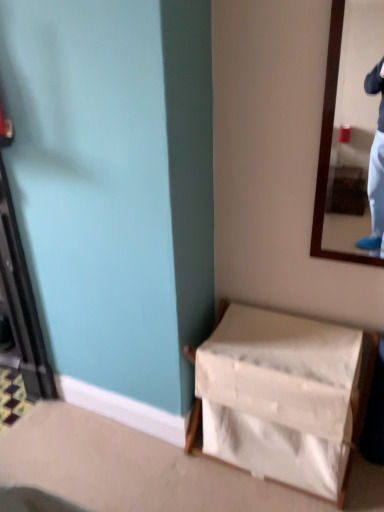
This screenshot has height=512, width=384. What do you see at coordinates (330, 143) in the screenshot? I see `wooden-framed mirror at upper right` at bounding box center [330, 143].

Where is `wooden-framed mirror at upper right`? wooden-framed mirror at upper right is located at coordinates (330, 143).

What is the approximate width of white fabric basket at lower right?

white fabric basket at lower right is 16.04 inches wide.

Identify the location of white fabric basket at lower right. The image size is (384, 512). (278, 396).

Image resolution: width=384 pixels, height=512 pixels. What do you see at coordinates (278, 396) in the screenshot? I see `white fabric basket at lower right` at bounding box center [278, 396].

Where is `wooden-framed mirror at upper right`? This screenshot has height=512, width=384. wooden-framed mirror at upper right is located at coordinates (330, 143).

In the image, is white fabric basket at lower right on the left side or the right side of wooden-framed mirror at upper right?

white fabric basket at lower right is positioned on wooden-framed mirror at upper right's left side.

Does white fabric basket at lower right lie in front of wooden-framed mirror at upper right?

No.

Does point (207, 420) lie in front of point (326, 106)?

No, it is not.

From the image's perspective, is white fabric basket at lower right above wooden-framed mirror at upper right?

Actually, white fabric basket at lower right appears below wooden-framed mirror at upper right in the image.

From a real-world perspective, which is physically below, white fabric basket at lower right or wooden-framed mirror at upper right?

In real-world perspective, white fabric basket at lower right is lower.

Considering the sizes of white fabric basket at lower right and wooden-framed mirror at upper right in the image, is white fabric basket at lower right wider or thinner than wooden-framed mirror at upper right?

white fabric basket at lower right is wider than wooden-framed mirror at upper right.

Consider the image. Does white fabric basket at lower right have a lesser height compared to wooden-framed mirror at upper right?

Yes, white fabric basket at lower right is shorter than wooden-framed mirror at upper right.

Considering the sizes of objects white fabric basket at lower right and wooden-framed mirror at upper right in the image provided, who is smaller, white fabric basket at lower right or wooden-framed mirror at upper right?

wooden-framed mirror at upper right is smaller.

Does white fabric basket at lower right contain wooden-framed mirror at upper right?

That's incorrect, wooden-framed mirror at upper right is not inside white fabric basket at lower right.

Is white fabric basket at lower right touching wooden-framed mirror at upper right?

No, white fabric basket at lower right is not next to wooden-framed mirror at upper right.

Is white fabric basket at lower right aimed at wooden-framed mirror at upper right?

No, white fabric basket at lower right does not turn towards wooden-framed mirror at upper right.

Can you tell me how much white fabric basket at lower right and wooden-framed mirror at upper right differ in facing direction?

They differ by 0.00792 degrees in their facing directions.

At what (x,y) coordinates should I click in order to perform the action: click on mirror on the right of white fabric basket at lower right. Please return your answer as a coordinate pair (x, y). The image size is (384, 512). Looking at the image, I should click on (330, 143).

Consider the image. Is wooden-framed mirror at upper right to the left of white fabric basket at lower right from the viewer's perspective?

Incorrect, wooden-framed mirror at upper right is not on the left side of white fabric basket at lower right.

Considering the relative positions of wooden-framed mirror at upper right and white fabric basket at lower right in the image provided, is wooden-framed mirror at upper right in front of white fabric basket at lower right?

Yes, wooden-framed mirror at upper right is closer to the viewer.

Is point (331, 44) closer or farther from the camera than point (209, 380)?

Point (331, 44) is closer to the camera than point (209, 380).

From the image's perspective, which is below, wooden-framed mirror at upper right or white fabric basket at lower right?

white fabric basket at lower right.

From a real-world perspective, relative to white fabric basket at lower right, is wooden-framed mirror at upper right vertically above or below?

Clearly, from a real-world perspective, wooden-framed mirror at upper right is above white fabric basket at lower right.

Can you confirm if wooden-framed mirror at upper right is thinner than white fabric basket at lower right?

Yes, wooden-framed mirror at upper right is thinner than white fabric basket at lower right.

Which of these two, wooden-framed mirror at upper right or white fabric basket at lower right, stands taller?

wooden-framed mirror at upper right is taller.

Can you confirm if wooden-framed mirror at upper right is bigger than white fabric basket at lower right?

Actually, wooden-framed mirror at upper right might be smaller than white fabric basket at lower right.

Can white fabric basket at lower right be found inside wooden-framed mirror at upper right?

No.

Is wooden-framed mirror at upper right touching white fabric basket at lower right?

No, wooden-framed mirror at upper right is not touching white fabric basket at lower right.

Is wooden-framed mirror at upper right oriented away from white fabric basket at lower right?

No, wooden-framed mirror at upper right is not facing the opposite direction of white fabric basket at lower right.

Identify the location of mirror in front of the white fabric basket at lower right. This screenshot has width=384, height=512. (330, 143).

Locate an element on the screen. mirror above the white fabric basket at lower right (from the image's perspective) is located at coordinates (330, 143).

Where is `furniture below the wooden-framed mirror at upper right (from the image's perspective)`? This screenshot has height=512, width=384. furniture below the wooden-framed mirror at upper right (from the image's perspective) is located at coordinates (278, 396).